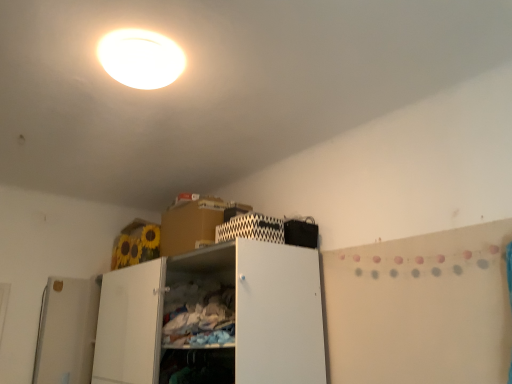
Question: Are black zigzag-patterned cabinet at upper center and white glossy ceiling light at upper center beside each other?

Choices:
 (A) yes
 (B) no

Answer: (B)

Question: From a real-world perspective, is black zigzag-patterned cabinet at upper center below white glossy ceiling light at upper center?

Choices:
 (A) yes
 (B) no

Answer: (A)

Question: From the image's perspective, is black zigzag-patterned cabinet at upper center located beneath white glossy ceiling light at upper center?

Choices:
 (A) no
 (B) yes

Answer: (B)

Question: Is black zigzag-patterned cabinet at upper center not close to white glossy ceiling light at upper center?

Choices:
 (A) yes
 (B) no

Answer: (B)

Question: Considering the relative positions of black zigzag-patterned cabinet at upper center and white glossy ceiling light at upper center in the image provided, is black zigzag-patterned cabinet at upper center to the left of white glossy ceiling light at upper center from the viewer's perspective?

Choices:
 (A) yes
 (B) no

Answer: (B)

Question: Can you confirm if black zigzag-patterned cabinet at upper center is thinner than white glossy ceiling light at upper center?

Choices:
 (A) yes
 (B) no

Answer: (A)

Question: Is white glossy ceiling light at upper center behind black zigzag-patterned cabinet at upper center?

Choices:
 (A) no
 (B) yes

Answer: (A)

Question: Is white glossy ceiling light at upper center smaller than black zigzag-patterned cabinet at upper center?

Choices:
 (A) yes
 (B) no

Answer: (B)

Question: Is white glossy ceiling light at upper center bigger than black zigzag-patterned cabinet at upper center?

Choices:
 (A) yes
 (B) no

Answer: (A)

Question: Is black zigzag-patterned cabinet at upper center inside white glossy ceiling light at upper center?

Choices:
 (A) yes
 (B) no

Answer: (B)

Question: From a real-world perspective, does white glossy ceiling light at upper center sit lower than black zigzag-patterned cabinet at upper center?

Choices:
 (A) no
 (B) yes

Answer: (A)

Question: Can you confirm if white glossy ceiling light at upper center is shorter than black zigzag-patterned cabinet at upper center?

Choices:
 (A) no
 (B) yes

Answer: (B)

Question: Is white glossy ceiling light at upper center positioned in front of white matte cabinet at center?

Choices:
 (A) no
 (B) yes

Answer: (B)